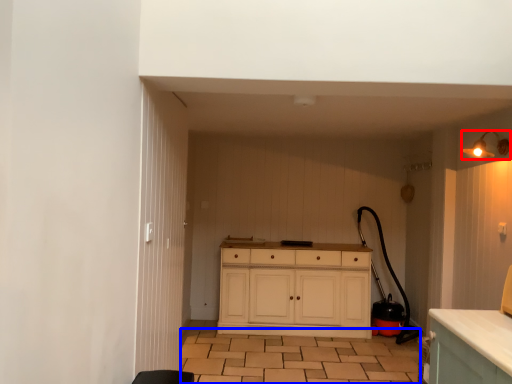
Question: Which object is further to the camera taking this photo, light fixture (highlighted by a red box) or tile (highlighted by a blue box)?

Choices:
 (A) light fixture
 (B) tile

Answer: (B)